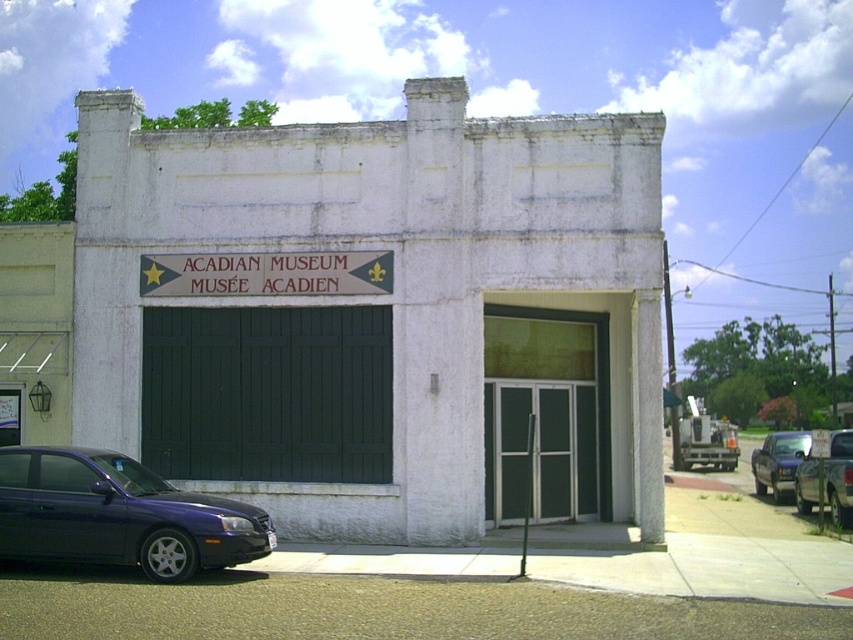
You are a visitor arriving at the ACADIAN MUSEUM and notice the metallic blue sedan at lower left and the white wooden sign at center. Which object is closer to the ground?

The metallic blue sedan at lower left is closer to the ground because it is below the white wooden sign at center.

From the picture: You are a delivery driver who needs to park your vehicle in the parking lot behind the ACADIAN MUSEUM. The parking lot has a narrow entrance that only allows vehicles narrower than the metallic blue sedan at center. Can your metallic silver truck at lower right fit through the entrance?

The metallic silver truck at lower right is thinner than the metallic blue sedan at center. Since the entrance requires vehicles to be narrower than the metallic blue sedan at center, the metallic silver truck at lower right can fit through the entrance.

You are a tour guide explaining the vehicles parked in front of the ACADIAN MUSEUM. You need to mention both the metallic blue sedan at lower left and the metallic blue sedan at center. Which one is narrower?

The metallic blue sedan at lower left is thinner than the metallic blue sedan at center, so the metallic blue sedan at lower left is narrower.